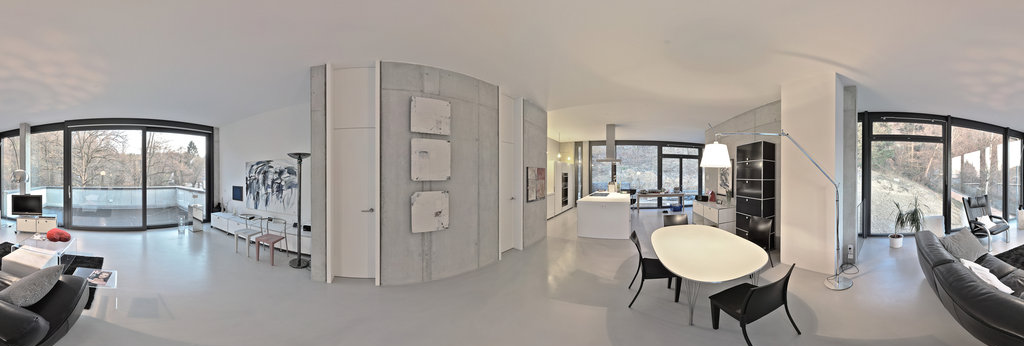
I want to click on lamp shade, so click(714, 166).